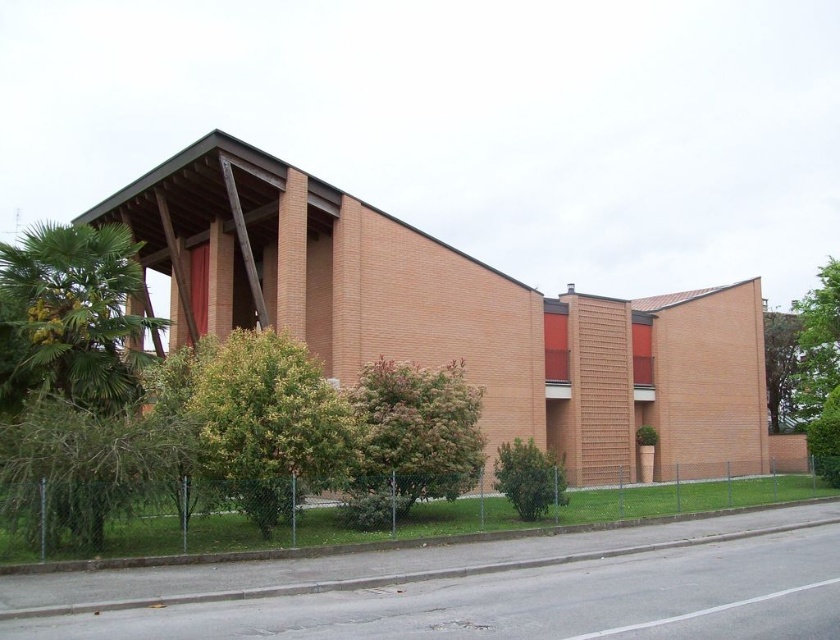
You are a landscape architect designing a pathway between the green leafy tree at center and the green leafy bush at lower center. Which object requires more space to accommodate its width?

The green leafy tree at center requires more space because its width surpasses the green leafy bush at lower center.

From the picture: You are a landscape architect planning to replace the smaller plants in the scene. Which of the two plants, the green leafy tree at lower left or the green leafy bush at lower center, should you consider replacing if you want to keep the larger one?

The green leafy bush at lower center should be replaced since the green leafy tree at lower left is bigger and should be kept.